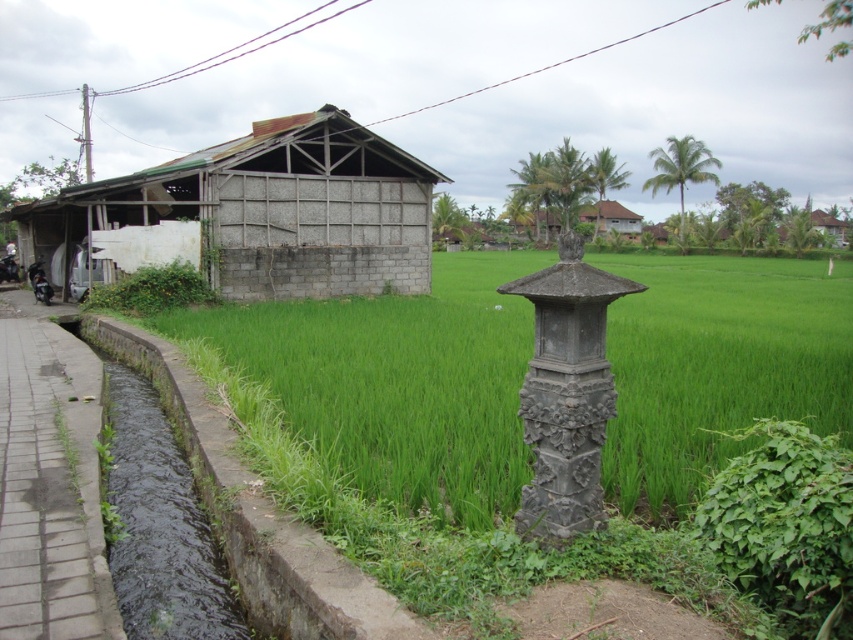
Is green grass at center bigger than dark gray stone pillar at center-right?

Yes, green grass at center is bigger than dark gray stone pillar at center-right.

Does green grass at center have a lesser height compared to dark gray stone pillar at center-right?

Incorrect, green grass at center's height does not fall short of dark gray stone pillar at center-right's.

Is point (634, 458) closer to camera compared to point (563, 403)?

No, it is not.

The image size is (853, 640). I want to click on green grass at center, so click(x=384, y=417).

Between point (592, 212) and point (805, 214), which one is positioned in front?

Positioned in front is point (805, 214).

Is brown thatched roof hut at center below wooden hut at upper right?

Incorrect, brown thatched roof hut at center is not positioned below wooden hut at upper right.

You are a GUI agent. You are given a task and a screenshot of the screen. Output one action in this format:
    pyautogui.click(x=<x>, y=<y>)
    Task: Click on the brown thatched roof hut at center
    
    Given the screenshot: What is the action you would take?
    pyautogui.click(x=610, y=218)

Looking at this image, is brick paved path at lower left above dark gray concrete at left?

Indeed, brick paved path at lower left is positioned over dark gray concrete at left.

How distant is brick paved path at lower left from dark gray concrete at left?

A distance of 39.30 inches exists between brick paved path at lower left and dark gray concrete at left.

You are a GUI agent. You are given a task and a screenshot of the screen. Output one action in this format:
    pyautogui.click(x=<x>, y=<y>)
    Task: Click on the brick paved path at lower left
    
    Given the screenshot: What is the action you would take?
    pyautogui.click(x=50, y=483)